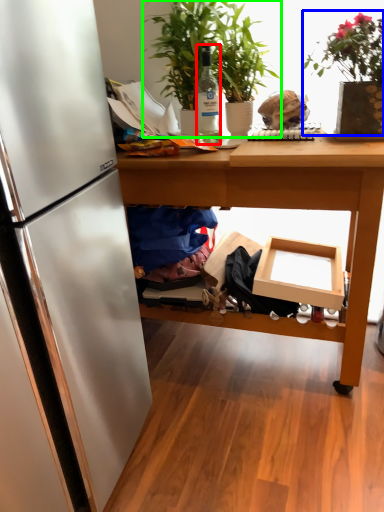
Question: Which object is the closest to the bottle (highlighted by a red box)? Choose among these: houseplant (highlighted by a blue box) or houseplant (highlighted by a green box).

Choices:
 (A) houseplant
 (B) houseplant

Answer: (B)